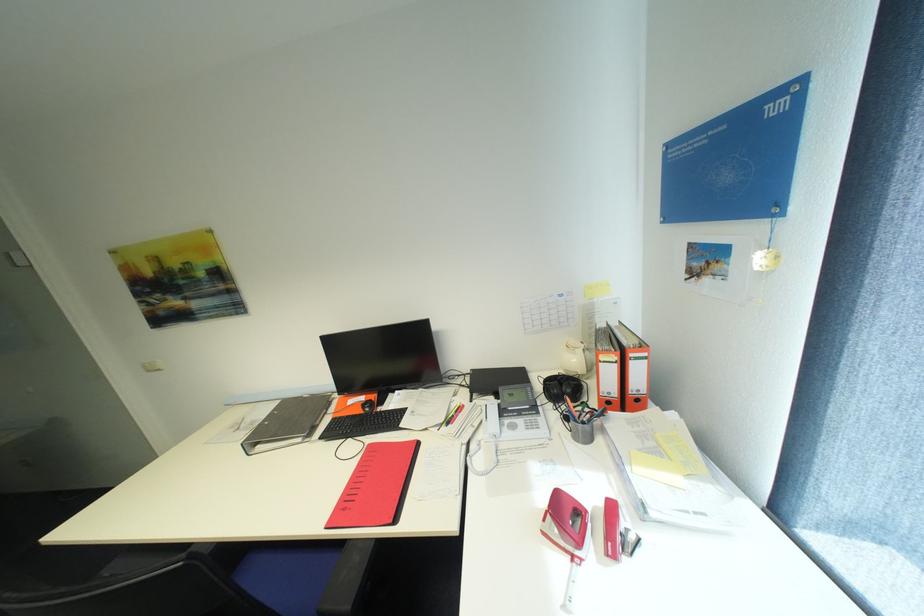
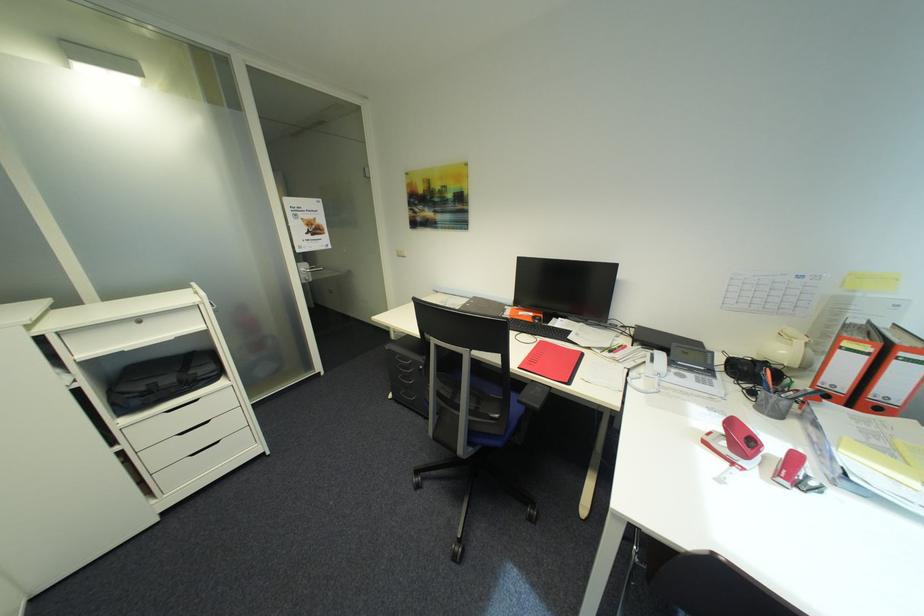
The point at (x=367, y=458) is marked in the first image. Where is the corresponding point in the second image?

(542, 345)